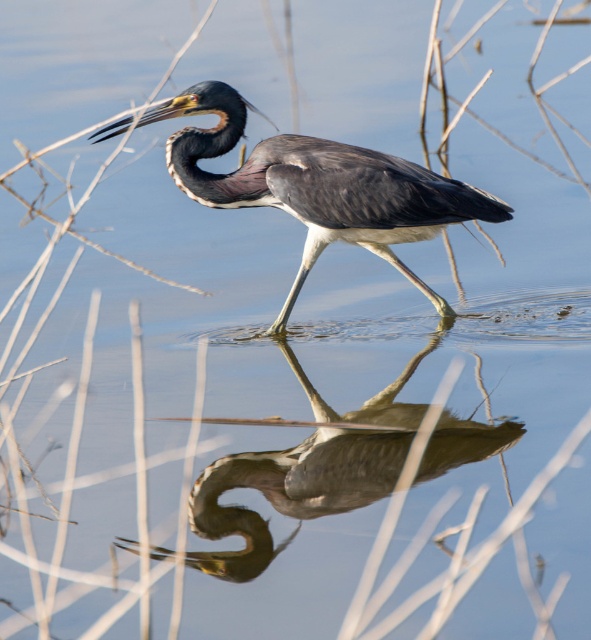
Which of these two, brown feathered heron at center or smooth gray heron at center, stands shorter?

With less height is smooth gray heron at center.

Which is more to the left, brown feathered heron at center or smooth gray heron at center?

Positioned to the left is brown feathered heron at center.

Locate an element on the screen. This screenshot has width=591, height=640. brown feathered heron at center is located at coordinates (319, 186).